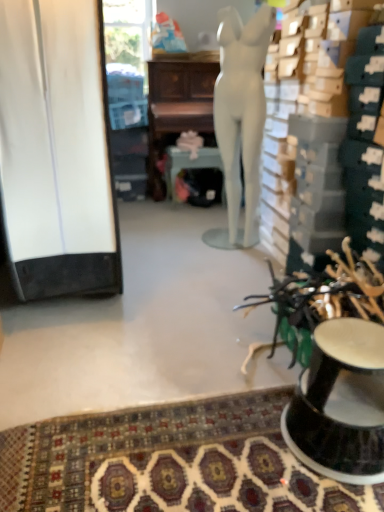
Identify the location of free space to the left of black glossy pedestal at lower right. click(x=235, y=448).